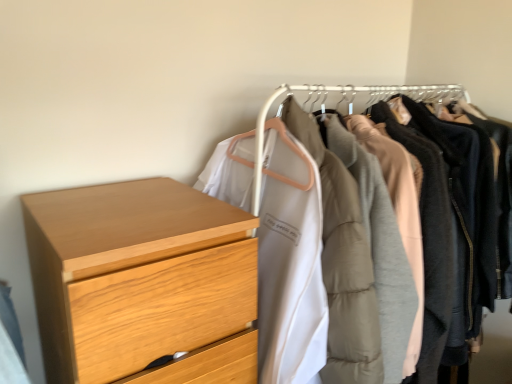
Question: Would you say matte white coat at center is to the left or to the right of light wood chest of drawers at left in the picture?

Choices:
 (A) left
 (B) right

Answer: (B)

Question: Is matte white coat at center taller or shorter than light wood chest of drawers at left?

Choices:
 (A) short
 (B) tall

Answer: (B)

Question: Is matte white coat at center wider or thinner than light wood chest of drawers at left?

Choices:
 (A) thin
 (B) wide

Answer: (B)

Question: Does point (215, 350) appear closer or farther from the camera than point (463, 97)?

Choices:
 (A) farther
 (B) closer

Answer: (B)

Question: Relative to matte white coat at center, is light wood chest of drawers at left in front or behind?

Choices:
 (A) front
 (B) behind

Answer: (A)

Question: Is light wood chest of drawers at left inside the boundaries of matte white coat at center, or outside?

Choices:
 (A) inside
 (B) outside

Answer: (B)

Question: From a real-world perspective, is light wood chest of drawers at left above or below matte white coat at center?

Choices:
 (A) below
 (B) above

Answer: (B)